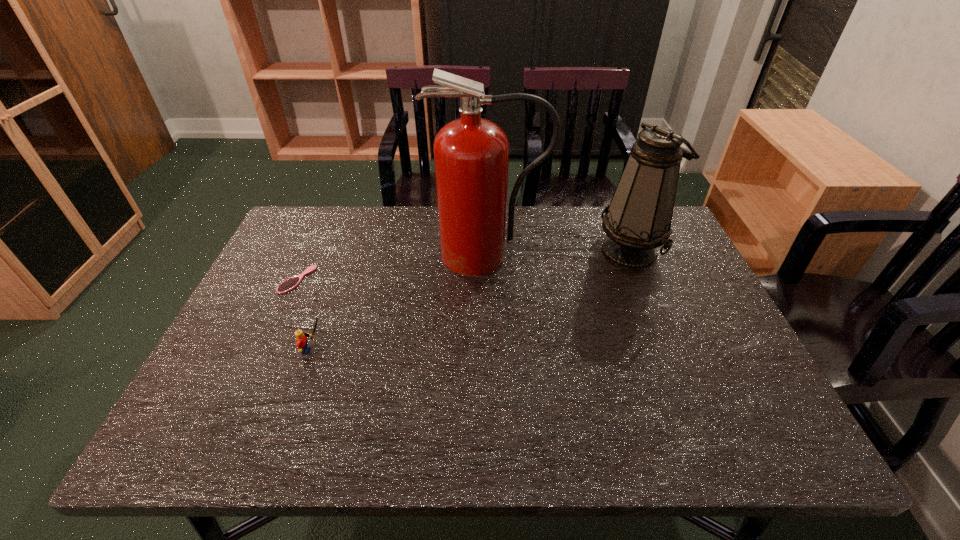
Find the location of `fire extinguisher`. fire extinguisher is located at coordinates (471, 155).

I want to click on the tallest object, so click(471, 155).

You are a GUI agent. You are given a task and a screenshot of the screen. Output one action in this format:
    pyautogui.click(x=<x>, y=<y>)
    Task: Click on the third shortest object
    This screenshot has height=540, width=960.
    Given the screenshot: What is the action you would take?
    pyautogui.click(x=638, y=219)

The height and width of the screenshot is (540, 960). In order to click on oil lamp in this screenshot , I will do `click(638, 219)`.

The width and height of the screenshot is (960, 540). I want to click on the second object from left to right, so click(301, 340).

This screenshot has width=960, height=540. Find the location of `the third tallest object`. the third tallest object is located at coordinates (301, 340).

The height and width of the screenshot is (540, 960). I want to click on the shortest object, so click(289, 284).

Identify the location of the leftmost object. This screenshot has height=540, width=960. (289, 284).

Locate an element on the screen. The height and width of the screenshot is (540, 960). vacant region located 0.090m with the handle and nozzle on the third object from left to right is located at coordinates (489, 299).

In order to click on blank area located on the front of the oil lamp in this screenshot , I will do `click(657, 312)`.